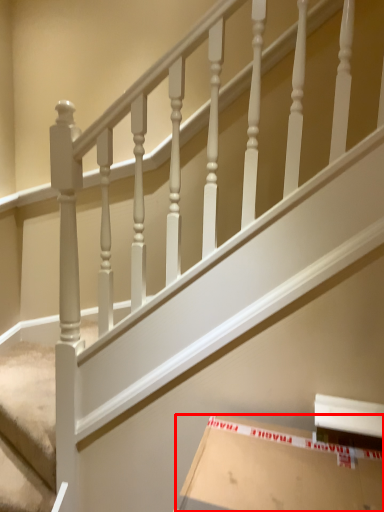
Question: Considering the relative positions of cardboard box (annotated by the red box) and stairwell in the image provided, where is cardboard box (annotated by the red box) located with respect to the staircase?

Choices:
 (A) right
 (B) left

Answer: (A)